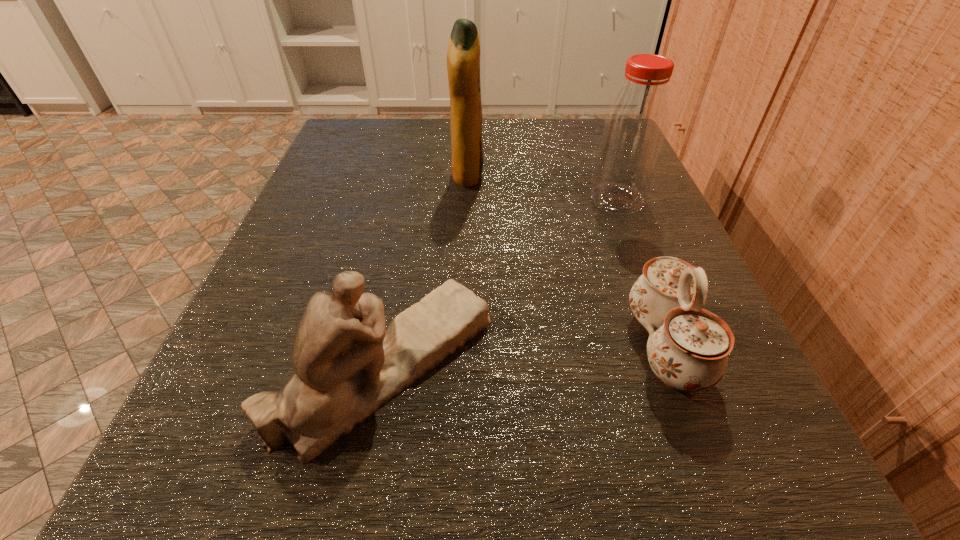
This screenshot has height=540, width=960. In order to click on detergent in this screenshot , I will do `click(463, 57)`.

Locate an element on the screen. bottle is located at coordinates (635, 125).

The width and height of the screenshot is (960, 540). Identify the location of the third tallest object. (347, 365).

This screenshot has width=960, height=540. I want to click on the shortest object, so click(x=688, y=346).

This screenshot has width=960, height=540. Identify the location of vacant space situated 0.090m on the label of the detergent. (533, 176).

Locate an element on the screen. The width and height of the screenshot is (960, 540). free region located 0.280m on the left of the bottle is located at coordinates (424, 199).

You are a GUI agent. You are given a task and a screenshot of the screen. Output one action in this format:
    pyautogui.click(x=<x>, y=<y>)
    Task: Click on the vacant area situated on the front-facing side of the figurine
    This screenshot has width=960, height=540.
    Given the screenshot: What is the action you would take?
    pyautogui.click(x=623, y=364)

This screenshot has width=960, height=540. Identify the location of free region located by the handle of the shortest object. (589, 347).

The image size is (960, 540). In order to click on free space located 0.290m by the handle of the shortest object in this screenshot , I will do `click(389, 347)`.

Image resolution: width=960 pixels, height=540 pixels. Find the location of `blank area located 0.090m by the handle of the shortest object`. blank area located 0.090m by the handle of the shortest object is located at coordinates (556, 347).